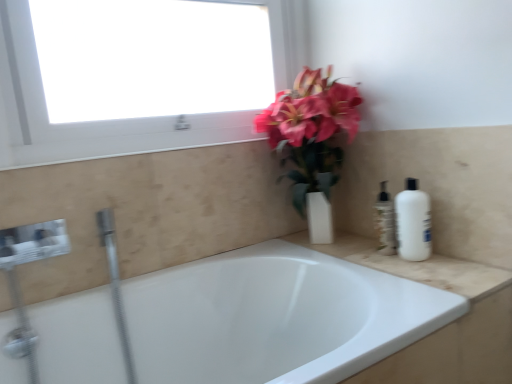
The height and width of the screenshot is (384, 512). What are the coordinates of `beige marble counter top at upper right` in the screenshot? It's located at (415, 266).

At what (x,y) coordinates should I click in order to perform the action: click on translucent plastic soap dispenser at right. Please return your answer as a coordinate pair (x, y). Looking at the image, I should click on (385, 222).

This screenshot has width=512, height=384. What do you see at coordinates (413, 223) in the screenshot?
I see `white matte bottle at right` at bounding box center [413, 223].

Identify the location of beige marble counter top at upper right. (415, 266).

Considering the relative sizes of matte white vase at upper center and translucent plastic soap dispenser at right in the image provided, is matte white vase at upper center thinner than translucent plastic soap dispenser at right?

No.

In the image, is matte white vase at upper center positioned in front of or behind translucent plastic soap dispenser at right?

Visually, matte white vase at upper center is located in front of translucent plastic soap dispenser at right.

In order to click on floral arrangement on the left of translucent plastic soap dispenser at right in this screenshot , I will do `click(311, 140)`.

Which is more to the right, matte white vase at upper center or translucent plastic soap dispenser at right?

translucent plastic soap dispenser at right.

In the image, is translucent plastic soap dispenser at right positioned in front of or behind matte white vase at upper center?

Clearly, translucent plastic soap dispenser at right is behind matte white vase at upper center.

Is translucent plastic soap dispenser at right bigger or smaller than matte white vase at upper center?

Clearly, translucent plastic soap dispenser at right is smaller in size than matte white vase at upper center.

Does white glossy window at upper left lie behind matte white vase at upper center?

No, white glossy window at upper left is closer to the camera.

Is point (12, 152) closer or farther from the camera than point (307, 153)?

Point (12, 152) is positioned closer to the camera compared to point (307, 153).

From the image's perspective, which is above, white glossy window at upper left or matte white vase at upper center?

From the image's view, white glossy window at upper left is above.

Is white glossy window at upper left outside of matte white vase at upper center?

Indeed, white glossy window at upper left is completely outside matte white vase at upper center.

From the image's perspective, is white glossy bathtub at center above or below white matte bottle at right?

Based on their image positions, white glossy bathtub at center is located beneath white matte bottle at right.

How distant is white glossy bathtub at center from white matte bottle at right?

A distance of 18.15 inches exists between white glossy bathtub at center and white matte bottle at right.

Is the position of white glossy bathtub at center more distant than that of white matte bottle at right?

No, it is in front of white matte bottle at right.

Is white matte bottle at right at the back of white glossy bathtub at center?

No, white glossy bathtub at center is not facing the opposite direction of white matte bottle at right.

Is white matte bottle at right closer to the viewer compared to beige marble counter top at upper right?

No, the depth of white matte bottle at right is greater than that of beige marble counter top at upper right.

Considering the sizes of white matte bottle at right and beige marble counter top at upper right in the image, is white matte bottle at right taller or shorter than beige marble counter top at upper right?

Considering their sizes, white matte bottle at right has more height than beige marble counter top at upper right.

Can you confirm if white matte bottle at right is thinner than beige marble counter top at upper right?

Yes, white matte bottle at right is thinner than beige marble counter top at upper right.

At what (x,y) coordinates should I click in order to perform the action: click on counter top on the left of white matte bottle at right. Please return your answer as a coordinate pair (x, y). Image resolution: width=512 pixels, height=384 pixels. Looking at the image, I should click on (415, 266).

Is beige marble counter top at upper right positioned before translucent plastic soap dispenser at right?

Yes, beige marble counter top at upper right is closer to the camera.

Which is behind, point (347, 235) or point (390, 245)?

Positioned behind is point (347, 235).

Between beige marble counter top at upper right and translucent plastic soap dispenser at right, which one has larger width?

Wider between the two is beige marble counter top at upper right.

In the scene shown: Does beige marble counter top at upper right turn towards translucent plastic soap dispenser at right?

No, beige marble counter top at upper right is not turned towards translucent plastic soap dispenser at right.

Is white glossy bathtub at center inside white glossy window at upper left?

Actually, white glossy bathtub at center is outside white glossy window at upper left.

Can you confirm if white glossy window at upper left is taller than white glossy bathtub at center?

Incorrect, the height of white glossy window at upper left is not larger of that of white glossy bathtub at center.

Where is `bathtub below the white glossy window at upper left (from the image's perspective)`? Image resolution: width=512 pixels, height=384 pixels. bathtub below the white glossy window at upper left (from the image's perspective) is located at coordinates (275, 317).

Is white glossy window at upper left facing away from white glossy bathtub at center?

No, white glossy window at upper left is not facing the opposite direction of white glossy bathtub at center.

This screenshot has height=384, width=512. What are the coordinates of `floral arrangement above the translucent plastic soap dispenser at right (from the image's perspective)` in the screenshot? It's located at (311, 140).

At what (x,y) coordinates should I click in order to perform the action: click on toiletry that is on the right side of matte white vase at upper center. Please return your answer as a coordinate pair (x, y). Image resolution: width=512 pixels, height=384 pixels. Looking at the image, I should click on (385, 222).

Looking at the image, which one is located further to white glossy bathtub at center, matte white vase at upper center or beige marble counter top at upper right?

The object further to white glossy bathtub at center is matte white vase at upper center.

When comparing their distances from matte white vase at upper center, does white glossy window at upper left or white matte bottle at right seem further?

Based on the image, white matte bottle at right appears to be further to matte white vase at upper center.

Looking at the image, which one is located further to matte white vase at upper center, beige marble counter top at upper right or white glossy bathtub at center?

white glossy bathtub at center.

Which object lies further to the anchor point white matte bottle at right, white glossy bathtub at center or white glossy window at upper left?

white glossy window at upper left lies further to white matte bottle at right than the other object.

From the image, which object appears to be nearer to beige marble counter top at upper right, white glossy bathtub at center or matte white vase at upper center?

white glossy bathtub at center.

Looking at the image, which one is located closer to beige marble counter top at upper right, white matte bottle at right or white glossy window at upper left?

The object closer to beige marble counter top at upper right is white matte bottle at right.

Considering their positions, is white glossy bathtub at center positioned further to translucent plastic soap dispenser at right than beige marble counter top at upper right?

Based on the image, white glossy bathtub at center appears to be further to translucent plastic soap dispenser at right.

In the scene shown: Estimate the real-world distances between objects in this image. Which object is further from white glossy window at upper left, matte white vase at upper center or translucent plastic soap dispenser at right?

translucent plastic soap dispenser at right is further to white glossy window at upper left.

Locate an element on the screen. Image resolution: width=512 pixels, height=384 pixels. counter top that lies between white glossy window at upper left and white glossy bathtub at center from top to bottom is located at coordinates (415, 266).

Find the location of a particular element. This screenshot has height=384, width=512. cleaning product between white glossy bathtub at center and matte white vase at upper center along the z-axis is located at coordinates (413, 223).

Identify the location of cleaning product that lies between white glossy window at upper left and white glossy bathtub at center from top to bottom. Image resolution: width=512 pixels, height=384 pixels. click(x=413, y=223).

Where is `floral arrangement between white glossy window at upper left and white glossy bathtub at center from top to bottom`? The height and width of the screenshot is (384, 512). floral arrangement between white glossy window at upper left and white glossy bathtub at center from top to bottom is located at coordinates (311, 140).